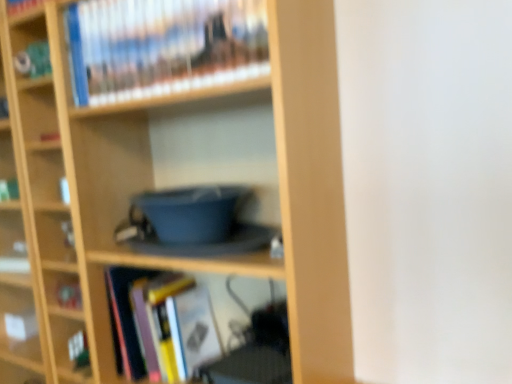
Question: From the image's perspective, is hardcover book at upper center, marked as the third book in a bottom-to-top arrangement, positioned above or below wooden bookcase at center?

Choices:
 (A) below
 (B) above

Answer: (B)

Question: In terms of width, does hardcover book at upper center, marked as the third book in a bottom-to-top arrangement, look wider or thinner when compared to wooden bookcase at center?

Choices:
 (A) thin
 (B) wide

Answer: (A)

Question: Which of these objects is positioned farthest from the hardcover book at upper center, which is counted as the 1th book, starting from the top?

Choices:
 (A) hardcover book at center, which is counted as the first book, starting from the bottom
 (B) hardcover book at lower left, which ranks as the 2th book in bottom-to-top order
 (C) wooden bookcase at center

Answer: (B)

Question: Which of these objects is positioned farthest from the hardcover book at center, acting as the third book starting from the top?

Choices:
 (A) hardcover book at lower left, which ranks as the 2th book in bottom-to-top order
 (B) wooden bookcase at center
 (C) hardcover book at upper center, which is counted as the 1th book, starting from the top

Answer: (C)